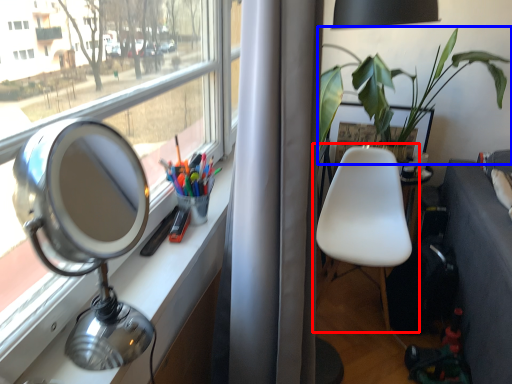
Question: Which of the following is the closest to the observer, chair (highlighted by a red box) or houseplant (highlighted by a blue box)?

Choices:
 (A) chair
 (B) houseplant

Answer: (B)